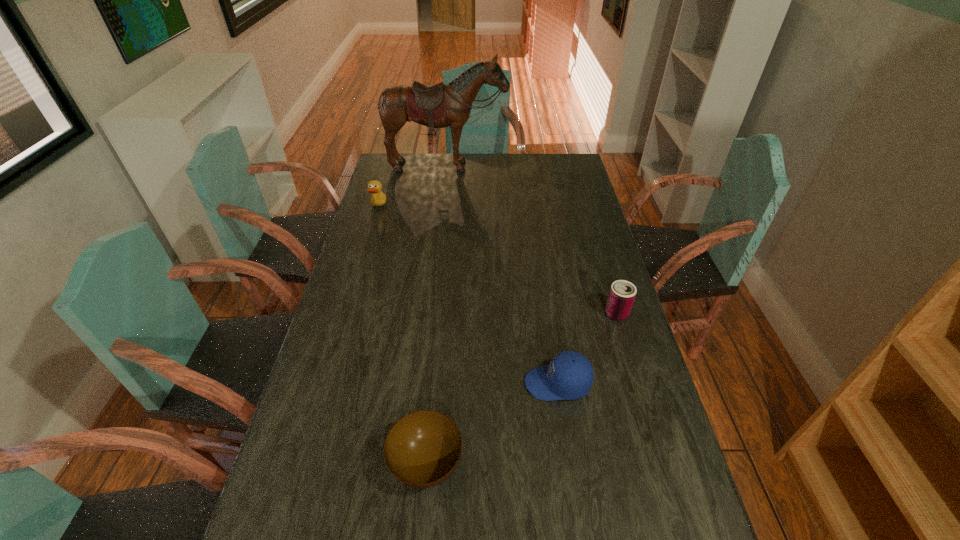
In order to click on vacant space at the far edge in this screenshot , I will do `click(474, 159)`.

Where is `free region at the left edge`? free region at the left edge is located at coordinates (372, 280).

In the image, there is a desktop. Where is `vacant space at the right edge`? Image resolution: width=960 pixels, height=540 pixels. vacant space at the right edge is located at coordinates (586, 282).

Locate an element on the screen. The height and width of the screenshot is (540, 960). empty space that is in between the nearest object and the third farthest object is located at coordinates (521, 389).

Find the location of a particular element. This screenshot has height=540, width=960. vacant point located between the rightmost object and the duck is located at coordinates (497, 260).

Where is `free space between the tallest object and the nearest object`? Image resolution: width=960 pixels, height=540 pixels. free space between the tallest object and the nearest object is located at coordinates (437, 315).

The image size is (960, 540). I want to click on vacant area that lies between the fourth nearest object and the third nearest object, so click(497, 260).

The image size is (960, 540). Find the location of `vacant area that lies between the rightmost object and the cap`. vacant area that lies between the rightmost object and the cap is located at coordinates (587, 348).

Where is `free area in between the duck and the rightmost object`? The width and height of the screenshot is (960, 540). free area in between the duck and the rightmost object is located at coordinates (497, 260).

Where is `blank region between the duck and the second nearest object`? This screenshot has width=960, height=540. blank region between the duck and the second nearest object is located at coordinates (468, 295).